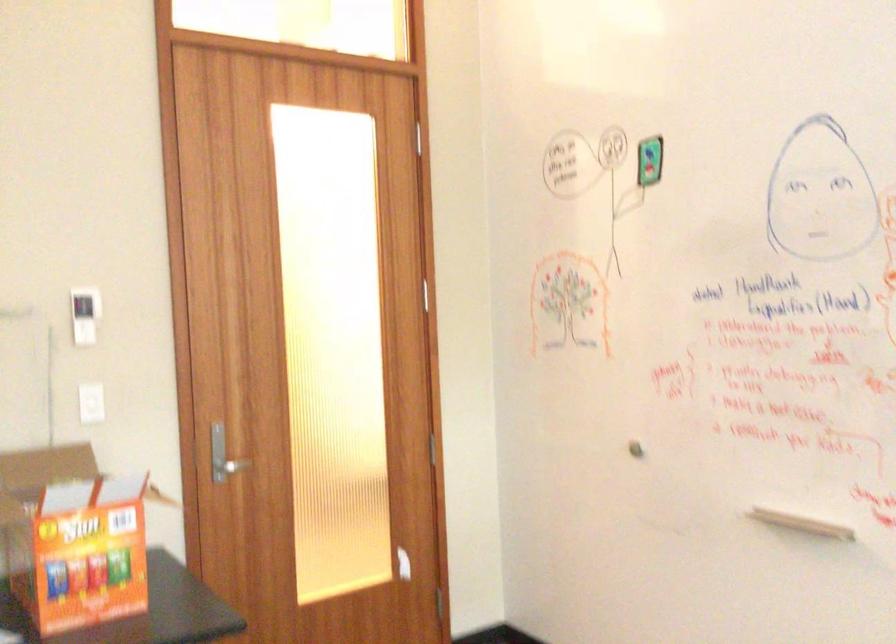
Where would you plac the whiteboard eraser tray? Please return your answer as a coordinate pair (x, y).

(800, 522)